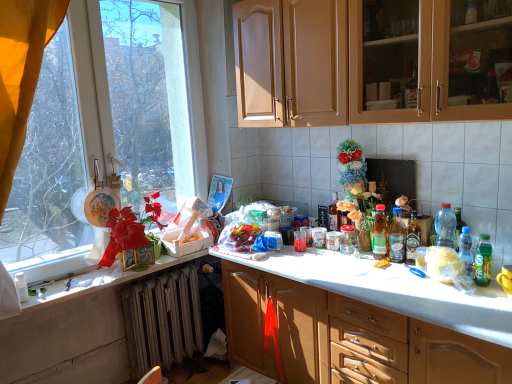
Question: Is green matte bottle at right, acting as the 6th bottle starting from the back, completely or partially outside of transparent glass window at upper left?

Choices:
 (A) no
 (B) yes

Answer: (B)

Question: Considering the relative sizes of green matte bottle at right, acting as the 6th bottle starting from the back, and transparent glass window at upper left in the image provided, is green matte bottle at right, acting as the 6th bottle starting from the back, taller than transparent glass window at upper left?

Choices:
 (A) yes
 (B) no

Answer: (B)

Question: From a real-world perspective, is green matte bottle at right, which is counted as the sixth bottle, starting from the left, under transparent glass window at upper left?

Choices:
 (A) yes
 (B) no

Answer: (A)

Question: Does green matte bottle at right, which is counted as the sixth bottle, starting from the left, have a greater width compared to transparent glass window at upper left?

Choices:
 (A) yes
 (B) no

Answer: (B)

Question: From the image's perspective, is green matte bottle at right, which ranks as the 1th bottle in right-to-left order, beneath transparent glass window at upper left?

Choices:
 (A) yes
 (B) no

Answer: (A)

Question: From the image's perspective, is matte white counter top at left positioned above or below gray metallic radiator at lower left?

Choices:
 (A) below
 (B) above

Answer: (B)

Question: Based on their positions, is matte white counter top at left located to the left or right of gray metallic radiator at lower left?

Choices:
 (A) left
 (B) right

Answer: (A)

Question: Is matte white counter top at left spatially inside gray metallic radiator at lower left, or outside of it?

Choices:
 (A) outside
 (B) inside

Answer: (A)

Question: Is matte white counter top at left wider or thinner than gray metallic radiator at lower left?

Choices:
 (A) wide
 (B) thin

Answer: (A)

Question: Visually, is gray metallic radiator at lower left positioned to the left or to the right of matte wood cabinets at upper center, acting as the first cabinetry starting from the top?

Choices:
 (A) right
 (B) left

Answer: (B)

Question: From the image's perspective, is gray metallic radiator at lower left located above or below matte wood cabinets at upper center, acting as the first cabinetry starting from the top?

Choices:
 (A) below
 (B) above

Answer: (A)

Question: In terms of width, does gray metallic radiator at lower left look wider or thinner when compared to matte wood cabinets at upper center, marked as the 2th cabinetry in a bottom-to-top arrangement?

Choices:
 (A) thin
 (B) wide

Answer: (A)

Question: From their relative heights in the image, would you say gray metallic radiator at lower left is taller or shorter than matte wood cabinets at upper center, marked as the 2th cabinetry in a bottom-to-top arrangement?

Choices:
 (A) short
 (B) tall

Answer: (A)

Question: Considering the positions of matte wood cabinets at upper center, acting as the first cabinetry starting from the top, and translucent plastic bottle at right, arranged as the 5th bottle when viewed from the left, in the image, is matte wood cabinets at upper center, acting as the first cabinetry starting from the top, wider or thinner than translucent plastic bottle at right, arranged as the 5th bottle when viewed from the left,?

Choices:
 (A) wide
 (B) thin

Answer: (A)

Question: From a real-world perspective, is matte wood cabinets at upper center, acting as the first cabinetry starting from the top, physically located above or below translucent plastic bottle at right, marked as the 2th bottle in a right-to-left arrangement?

Choices:
 (A) above
 (B) below

Answer: (A)